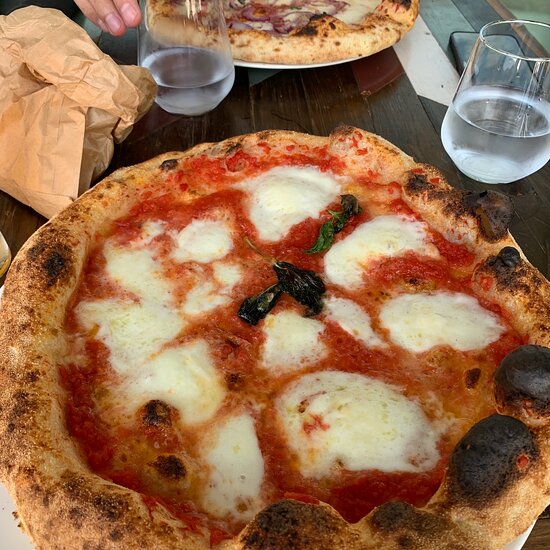
I want to click on brown table, so click(x=272, y=102).